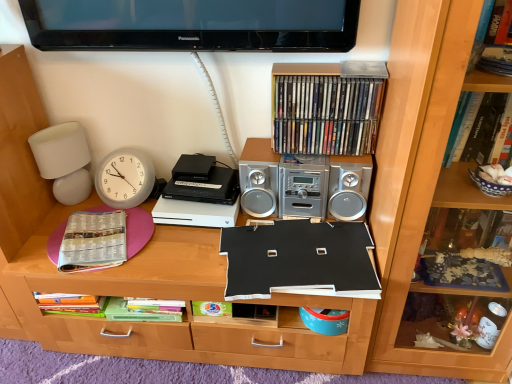
Where is `empty space that is ontop of silver metallic stereo at upper center (from a real-world perspective)`? The width and height of the screenshot is (512, 384). empty space that is ontop of silver metallic stereo at upper center (from a real-world perspective) is located at coordinates (298, 157).